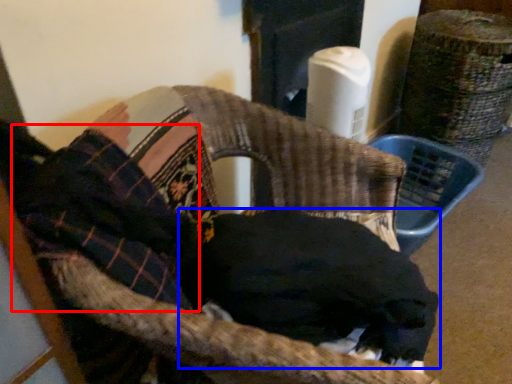
Question: Which object is further to the camera taking this photo, clothing (highlighted by a red box) or dog (highlighted by a blue box)?

Choices:
 (A) clothing
 (B) dog

Answer: (B)